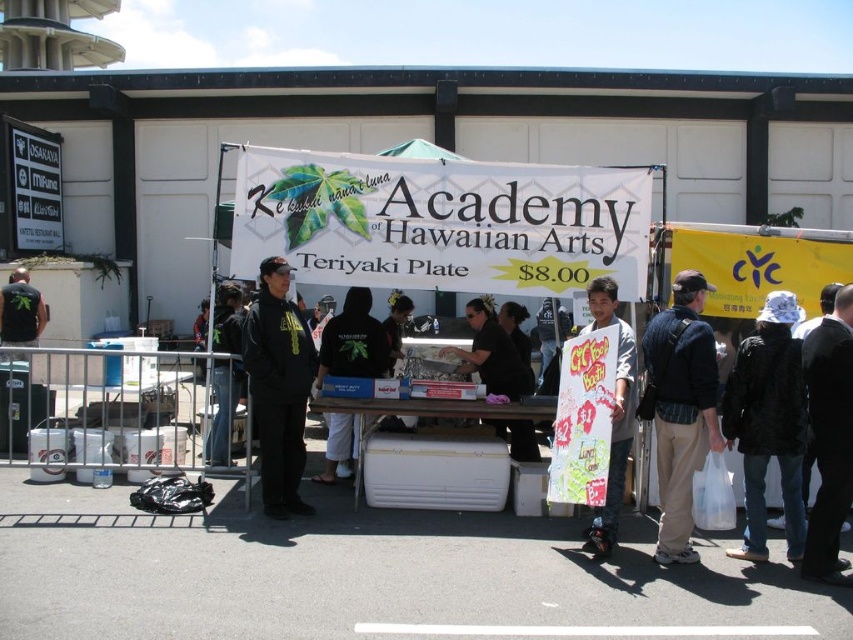
You are at the food stall and want to know which of the two points, point (659, 490) or point (276, 371), is closer to you. Based on the scene description, which point is nearer?

Point (659, 490) is closer to the viewer than point (276, 371).

You are organizing a safety inspection for the event and need to ensure there is enough space between attendees. The safety guideline requires at least 2 meters between people. Are the dark blue jacket at center and black matte hoodie at center spaced appropriately according to the guideline?

The dark blue jacket at center and black matte hoodie at center are 2.63 meters apart, which exceeds the required 2 meters, so they are spaced appropriately according to the safety guideline.

You are a customer at the event and want to locate the person wearing the white cotton hat at lower right. Which direction should you move relative to the dark blue jacket at center?

To locate the white cotton hat at lower right, move to the right of the dark blue jacket at center since the dark blue jacket at center is to the left of white cotton hat at lower right.